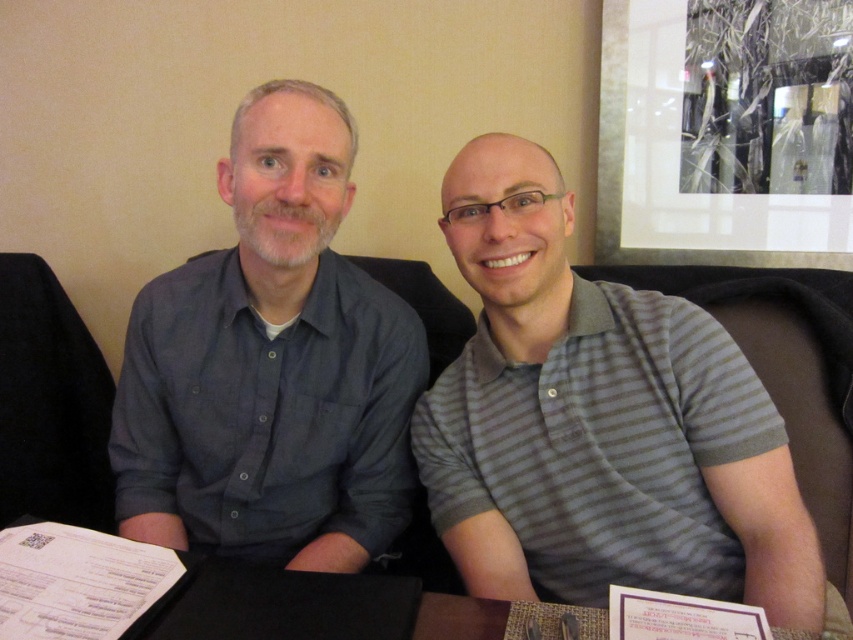
You are a photographer trying to capture a closeup of the gray striped polo shirt at center and the black leather table at lower center. Since you can only focus on one object at a time, which object should you choose to ensure it fills more of your camera frame?

The gray striped polo shirt at center is larger in size than the black leather table at lower center, so you should focus on the gray striped polo shirt at center to fill more of the camera frame.

You are standing in the room and want to move from the point at coordinates (225,284) to the point at coordinates (288,109). Which direction should you move to get closer to the latter point?

To move from point (225,284) to point (288,109), you should move towards the left and slightly downward since point (288,109) is located to the left and slightly lower than point (225,284).